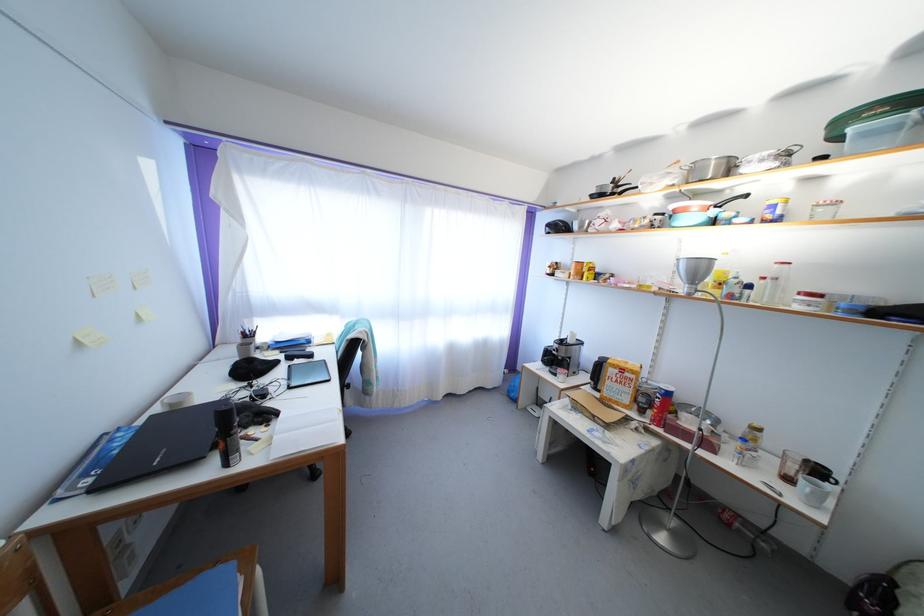
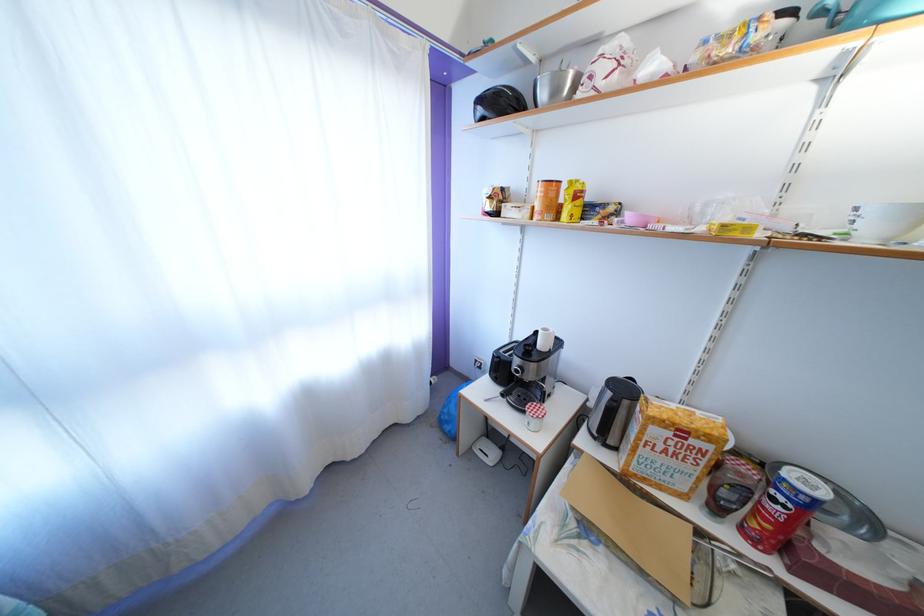
Locate, in the second image, the point that corresponds to (628,371) in the first image.

(688, 428)